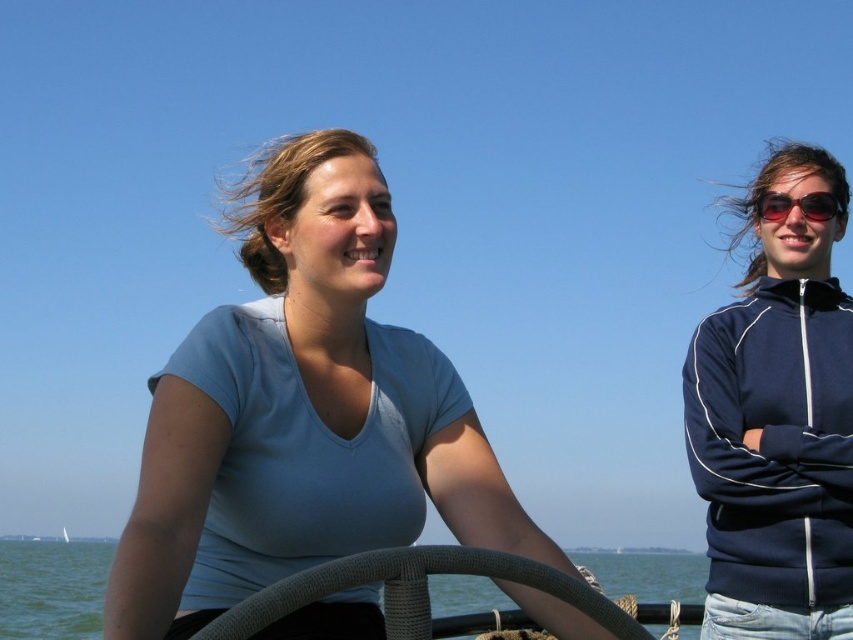
You are on a boat with two people. There are two points marked on the boat. The first point is at coordinates point (698, 410) and the second is at point (297, 582). If you are facing the front of the boat, which point is closer to you?

Point (297, 582) is closer to you because it is in front of point (698, 410) when facing the front of the boat.

You are a photographer trying to capture a clear photo of both the matte blue shirt at center and the textured grey steering wheel at center. Since the camera can only focus on one object at a time, which object should you focus on to ensure it appears larger in the photo?

The matte blue shirt at center is bigger than the textured grey steering wheel at center, so you should focus on the matte blue shirt at center to ensure it appears larger in the photo.